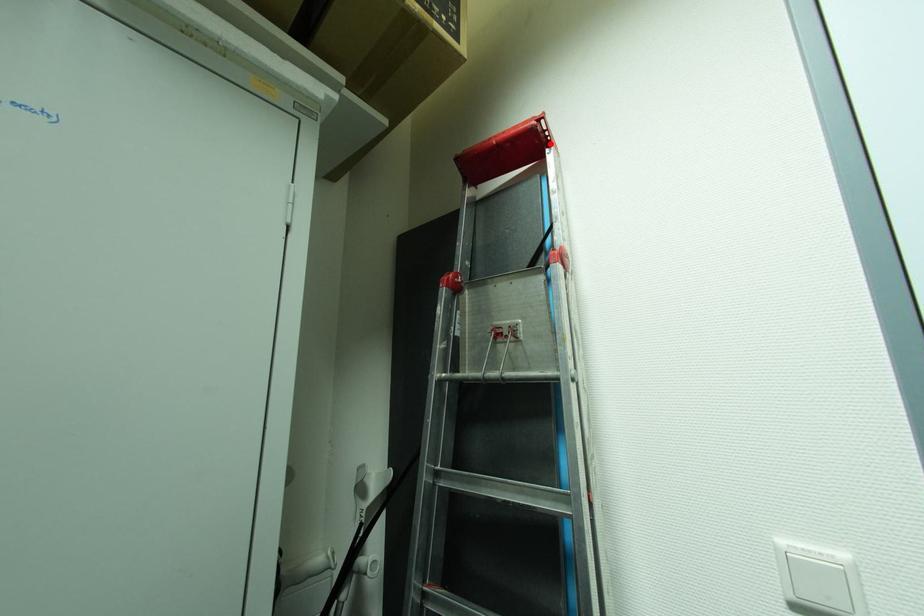
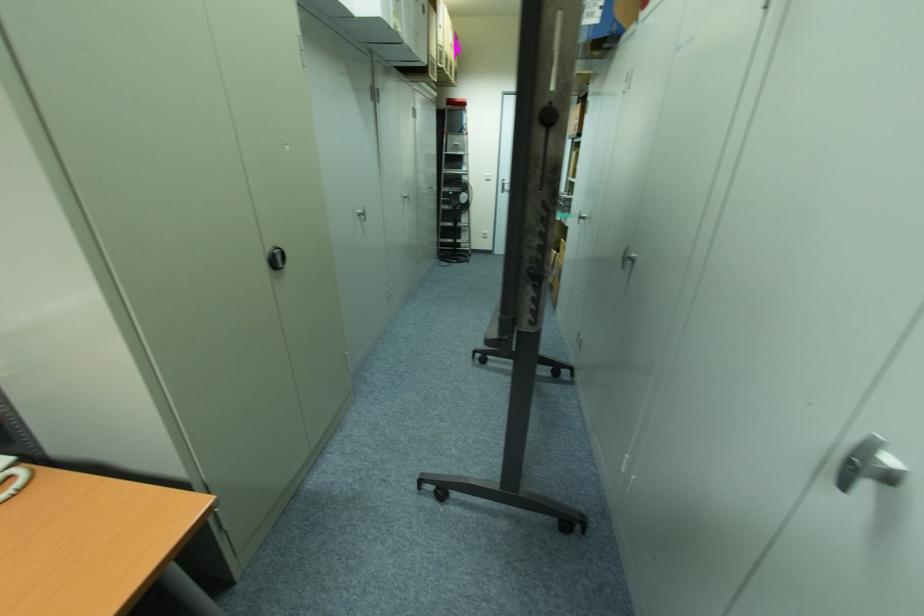
Question: I am providing you with two images of the same scene from different viewpoints. Image1 has a red point marked. In image2, the corresponding 3D location appears at what relative position? Reply with the corresponding letter.

Choices:
 (A) Closer
 (B) Farther

Answer: (A)